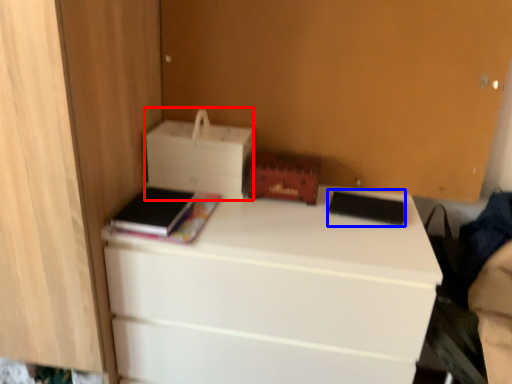
Question: Which of the following is the farthest to the observer, printer (highlighted by a red box) or paperback book (highlighted by a blue box)?

Choices:
 (A) printer
 (B) paperback book

Answer: (A)